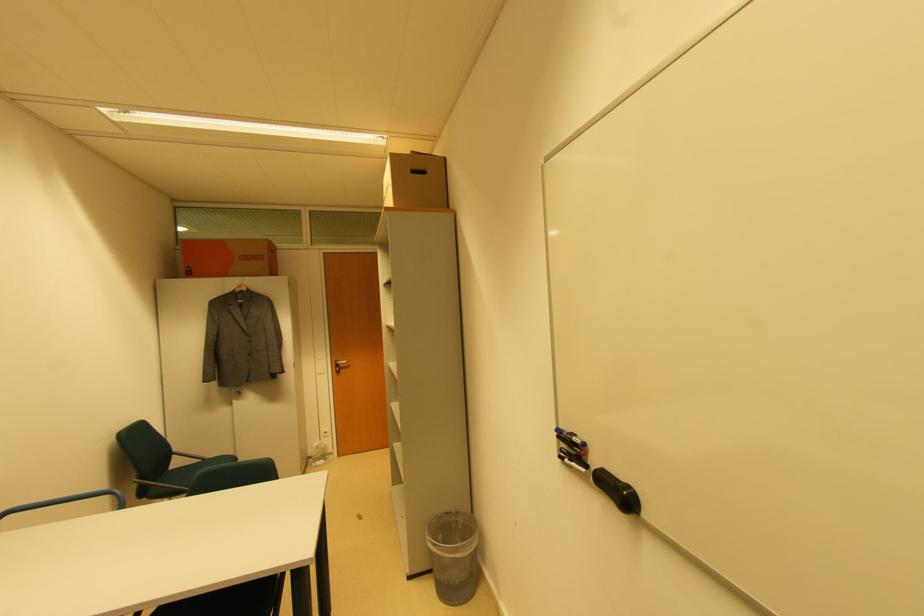
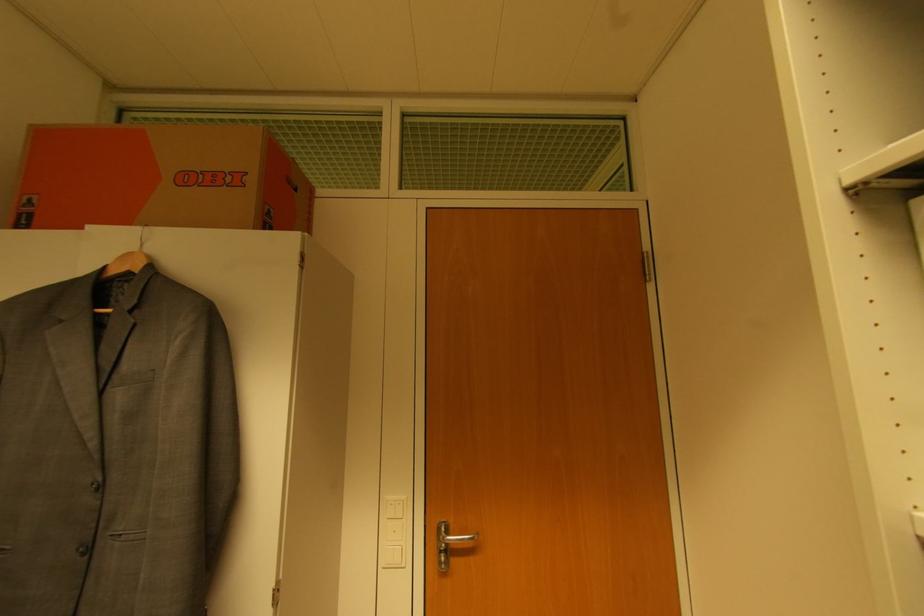
Locate, in the second image, the point that corresponds to point (192, 274) in the first image.

(32, 217)